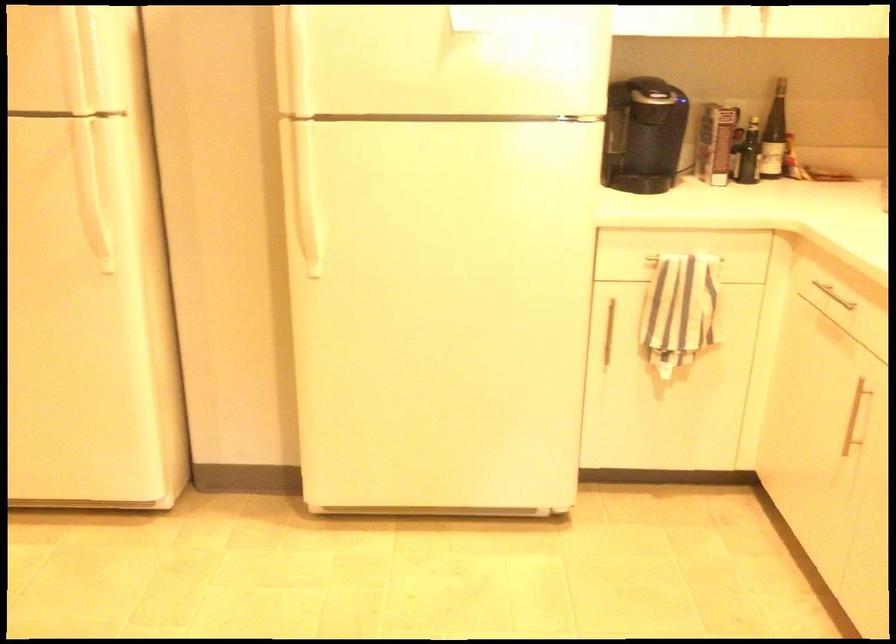
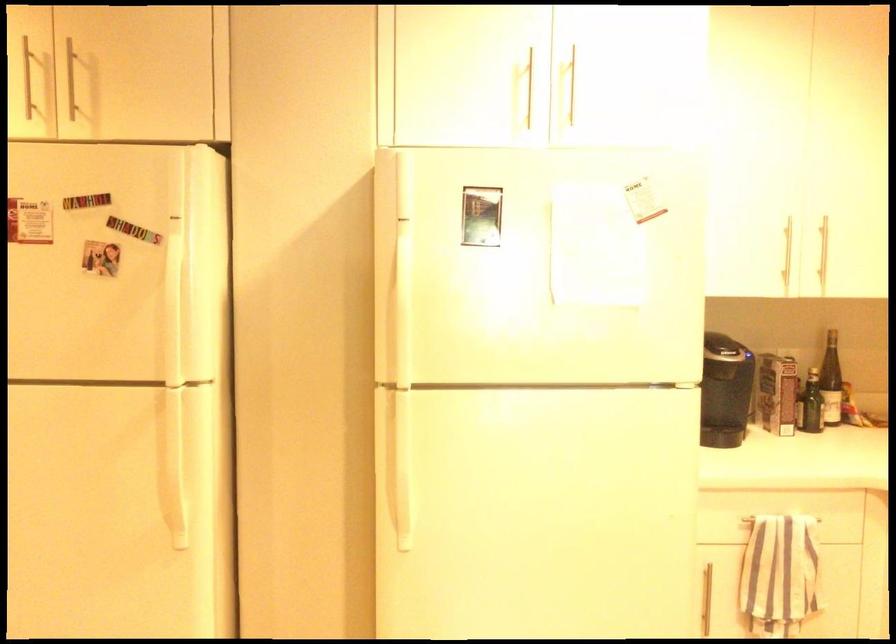
Where in the second image is the point corresponding to (x=711, y=142) from the first image?

(777, 393)